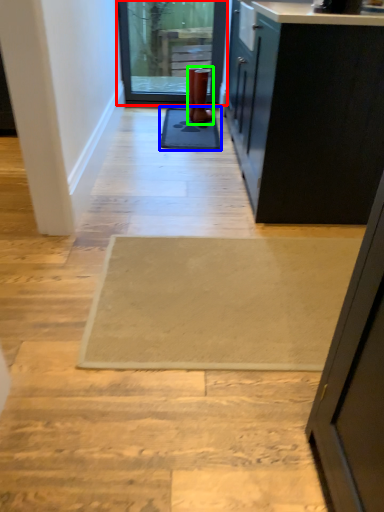
Question: Estimate the real-world distances between objects in this image. Which object is closer to door (highlighted by a red box), mat (highlighted by a blue box) or boot (highlighted by a green box)?

Choices:
 (A) mat
 (B) boot

Answer: (B)